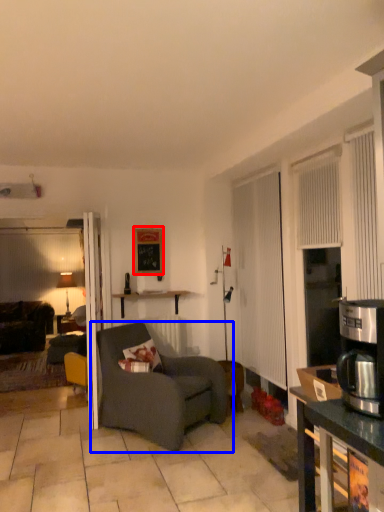
Question: Which object is further to the camera taking this photo, picture frame (highlighted by a red box) or chair (highlighted by a blue box)?

Choices:
 (A) picture frame
 (B) chair

Answer: (A)